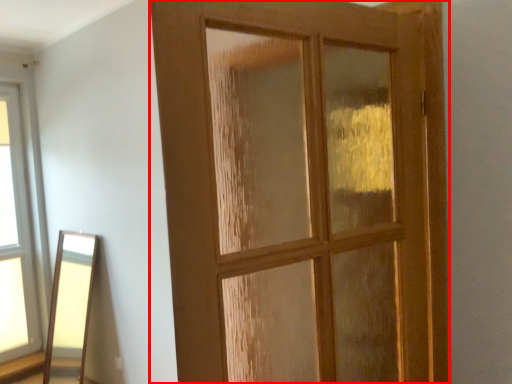
Question: Considering the relative positions of door (annotated by the red box) and window in the image provided, where is door (annotated by the red box) located with respect to the staircase?

Choices:
 (A) left
 (B) right

Answer: (B)